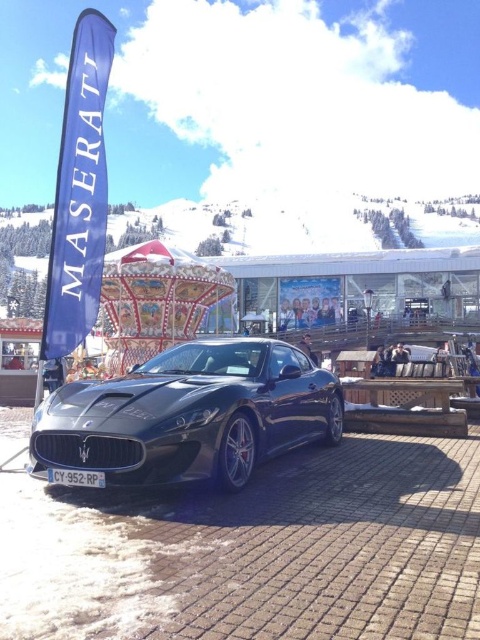
Question: Which point is farther from the camera taking this photo?

Choices:
 (A) (216, 428)
 (B) (423, 416)

Answer: (B)

Question: Where is glossy black sports car at center located in relation to wooden picnic table at center in the image?

Choices:
 (A) left
 (B) right

Answer: (A)

Question: Which of the following is the closest to the observer?

Choices:
 (A) (433, 422)
 (B) (248, 342)

Answer: (B)

Question: Can you confirm if glossy black sports car at center is bigger than wooden picnic table at center?

Choices:
 (A) no
 (B) yes

Answer: (B)

Question: Does glossy black sports car at center come in front of wooden picnic table at center?

Choices:
 (A) yes
 (B) no

Answer: (A)